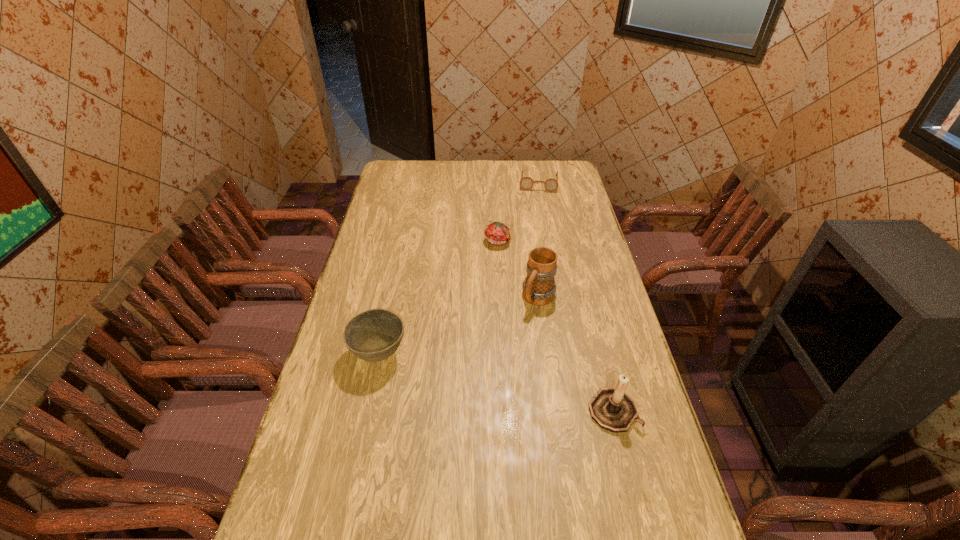
I want to click on vacant space located 0.180m on the front-facing side of the second shortest object, so click(x=503, y=281).

I want to click on blank area located on the front-facing side of the second shortest object, so click(x=508, y=327).

Image resolution: width=960 pixels, height=540 pixels. I want to click on vacant space located on the front-facing side of the second shortest object, so click(x=506, y=307).

You are a GUI agent. You are given a task and a screenshot of the screen. Output one action in this format:
    pyautogui.click(x=<x>, y=<y>)
    Task: Click on the free space located on the side of the mug with the handle
    Image resolution: width=960 pixels, height=540 pixels.
    Given the screenshot: What is the action you would take?
    pyautogui.click(x=477, y=391)

Identify the location of vacant space located 0.260m on the side of the mug with the handle. (494, 366).

Identify the location of vacant space located on the side of the mug with the handle. (479, 388).

You are a GUI agent. You are given a task and a screenshot of the screen. Output one action in this format:
    pyautogui.click(x=<x>, y=<y>)
    Task: Click on the free space located on the front-facing side of the shortest object
    
    Given the screenshot: What is the action you would take?
    pyautogui.click(x=535, y=237)

This screenshot has width=960, height=540. I want to click on vacant point located on the front-facing side of the shortest object, so pos(534,244).

This screenshot has width=960, height=540. What are the coordinates of `free space located 0.320m on the front-facing side of the shortest object` in the screenshot? It's located at (535, 234).

Locate an element on the screen. The width and height of the screenshot is (960, 540). object at the far edge is located at coordinates (526, 183).